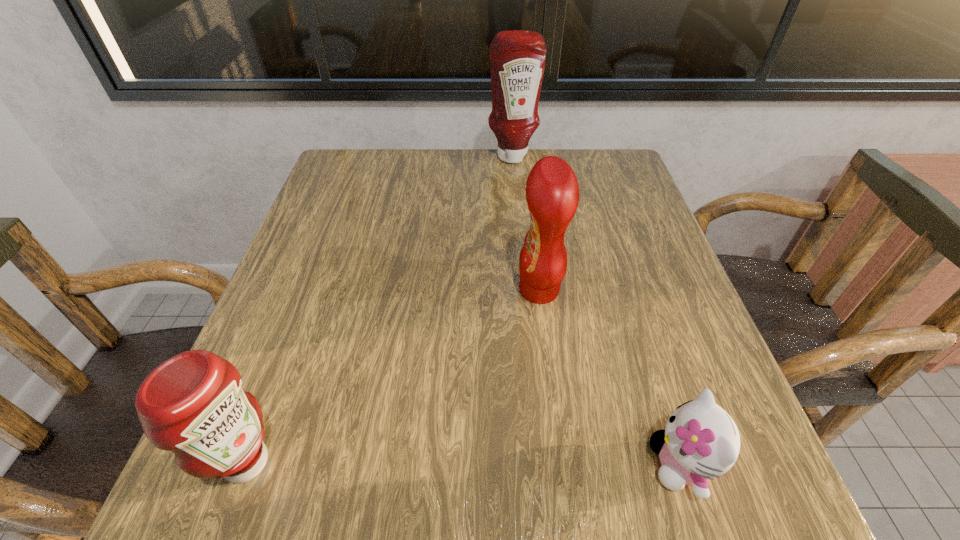
The width and height of the screenshot is (960, 540). I want to click on the tallest object, so [x=517, y=58].

Locate an element on the screen. The width and height of the screenshot is (960, 540). the farthest object is located at coordinates (517, 58).

I want to click on the second tallest condiment, so click(552, 193).

In order to click on the second tallest object in this screenshot , I will do tap(552, 193).

Locate an element on the screen. The width and height of the screenshot is (960, 540). the leftmost object is located at coordinates (193, 404).

The height and width of the screenshot is (540, 960). I want to click on the nearest condiment, so click(193, 404).

Find the location of a particular element. The width and height of the screenshot is (960, 540). kitten is located at coordinates (700, 440).

Identify the location of the shortest object. (700, 440).

Identify the location of vacant space located on the left of the tallest condiment. tap(373, 156).

Identify the location of blank space located 0.240m on the label side of the third nearest object. The image size is (960, 540). (387, 290).